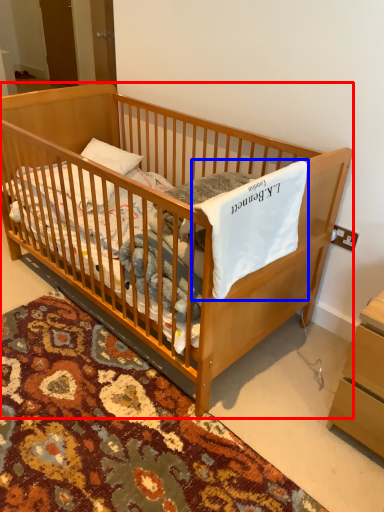
Question: Which point is closer to the camera, infant bed (highlighted by a red box) or sheet (highlighted by a blue box)?

Choices:
 (A) infant bed
 (B) sheet

Answer: (B)